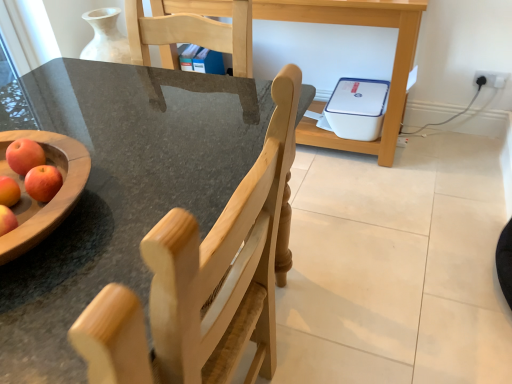
Question: Is white plastic electric outlet at upper right spatially inside white plastic printer at center, or outside of it?

Choices:
 (A) outside
 (B) inside

Answer: (A)

Question: From a real-world perspective, relative to white plastic printer at center, is white plastic electric outlet at upper right vertically above or below?

Choices:
 (A) above
 (B) below

Answer: (B)

Question: Which is farther from the white plastic printer at center?

Choices:
 (A) red matte apple at left
 (B) natural wood chair at center
 (C) white plastic electric outlet at upper right

Answer: (A)

Question: Which is farther from the white plastic electric outlet at upper right?

Choices:
 (A) red matte apple at left
 (B) natural wood chair at center
 (C) white plastic printer at center

Answer: (A)